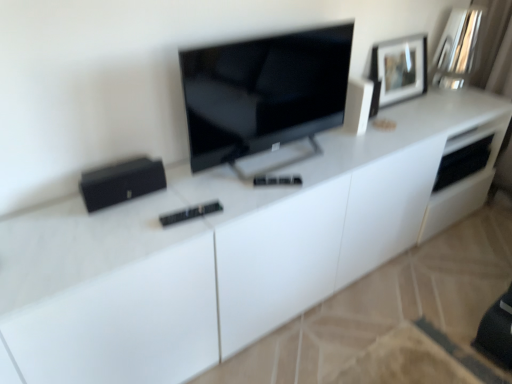
Question: Should I look upward or downward to see black matte speaker at left, positioned as the second appliance in back-to-front order?

Choices:
 (A) up
 (B) down

Answer: (A)

Question: Could you tell me if black matte speaker at left, placed as the first appliance when sorted from front to back, is turned towards matte black tv at center?

Choices:
 (A) no
 (B) yes

Answer: (A)

Question: Can you confirm if black matte speaker at left, positioned as the second appliance in back-to-front order, is thinner than matte black tv at center?

Choices:
 (A) no
 (B) yes

Answer: (A)

Question: Is black matte speaker at left, placed as the first appliance when sorted from front to back, not within matte black tv at center?

Choices:
 (A) yes
 (B) no

Answer: (A)

Question: Is the position of black matte speaker at left, the 2th appliance from the right, less distant than that of matte black tv at center?

Choices:
 (A) no
 (B) yes

Answer: (A)

Question: Is black matte speaker at left, placed as the first appliance when sorted from front to back, facing away from matte black tv at center?

Choices:
 (A) no
 (B) yes

Answer: (A)

Question: Is black matte speaker at left, placed as the first appliance when sorted from front to back, smaller than matte black tv at center?

Choices:
 (A) yes
 (B) no

Answer: (A)

Question: Is white glossy speaker at upper right, which appears as the 2th appliance when ordered from the bottom, facing towards black matte speaker at left, the 2th appliance from the right?

Choices:
 (A) no
 (B) yes

Answer: (A)

Question: From the image's perspective, is white glossy speaker at upper right, the first appliance from the right, over black matte speaker at left, placed as the 1th appliance when sorted from left to right?

Choices:
 (A) no
 (B) yes

Answer: (B)

Question: Is white glossy speaker at upper right, the first appliance from the back, further to camera compared to black matte speaker at left, positioned as the second appliance in back-to-front order?

Choices:
 (A) yes
 (B) no

Answer: (A)

Question: Is white glossy speaker at upper right, the first appliance from the back, bigger than black matte speaker at left, positioned as the second appliance in back-to-front order?

Choices:
 (A) no
 (B) yes

Answer: (A)

Question: Is white glossy speaker at upper right, which appears as the 2th appliance when ordered from the bottom, not inside black matte speaker at left, placed as the first appliance when sorted from front to back?

Choices:
 (A) yes
 (B) no

Answer: (A)

Question: From a real-world perspective, is white glossy speaker at upper right, which appears as the 2th appliance when ordered from the bottom, positioned under black matte speaker at left, positioned as the first appliance in bottom-to-top order, based on gravity?

Choices:
 (A) no
 (B) yes

Answer: (A)

Question: Considering the relative sizes of black matte speaker at left, the 2th appliance from the right, and matte black picture frame at upper right in the image provided, is black matte speaker at left, the 2th appliance from the right, taller than matte black picture frame at upper right?

Choices:
 (A) yes
 (B) no

Answer: (B)